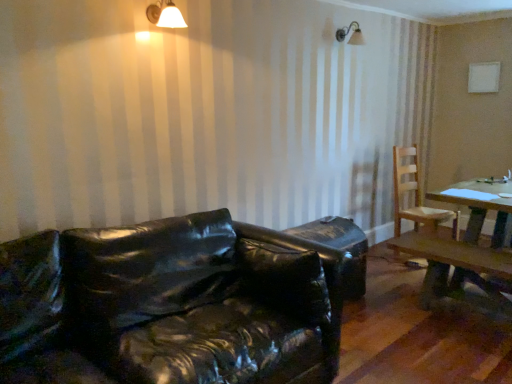
Measure the distance between glossy black leather couch at lower left and camera.

glossy black leather couch at lower left and camera are 5.23 feet apart.

Image resolution: width=512 pixels, height=384 pixels. Describe the element at coordinates (455, 266) in the screenshot. I see `wooden table at right` at that location.

What do you see at coordinates (165, 15) in the screenshot?
I see `white matte light fixture at upper center` at bounding box center [165, 15].

The height and width of the screenshot is (384, 512). What are the coordinates of `glossy black leather couch at lower left` in the screenshot? It's located at (178, 302).

Considering the sizes of objects glossy black leather couch at lower left and light brown wooden chair at right in the image provided, who is wider, glossy black leather couch at lower left or light brown wooden chair at right?

glossy black leather couch at lower left is wider.

In the scene shown: From a real-world perspective, is glossy black leather couch at lower left under light brown wooden chair at right?

Yes.

Is glossy black leather couch at lower left inside the boundaries of light brown wooden chair at right, or outside?

glossy black leather couch at lower left cannot be found inside light brown wooden chair at right.

Consider the image. Is light brown wooden chair at right outside of glossy black leather couch at lower left?

Yes, light brown wooden chair at right is located beyond the bounds of glossy black leather couch at lower left.

At what (x,y) coordinates should I click in order to perform the action: click on studio couch located underneath the light brown wooden chair at right (from a real-world perspective). Please return your answer as a coordinate pair (x, y). The image size is (512, 384). Looking at the image, I should click on (178, 302).

Is point (396, 207) farther from camera compared to point (13, 266)?

Yes, point (396, 207) is farther from viewer.

Looking at this image, from a real-world perspective, is light brown wooden chair at right above or below glossy black leather couch at lower left?

From a real-world perspective, light brown wooden chair at right is physically above glossy black leather couch at lower left.

Which is more to the right, wooden table at right or light brown wooden chair at right?

light brown wooden chair at right.

From the picture: Is wooden table at right further to camera compared to light brown wooden chair at right?

No, wooden table at right is closer to the camera.

Considering the sizes of objects wooden table at right and light brown wooden chair at right in the image provided, who is shorter, wooden table at right or light brown wooden chair at right?

wooden table at right is shorter.

Does wooden table at right turn towards light brown wooden chair at right?

Yes, wooden table at right is facing light brown wooden chair at right.

From the image's perspective, is light brown wooden chair at right over wooden table at right?

Correct, light brown wooden chair at right appears higher than wooden table at right in the image.

Does point (402, 193) come in front of point (464, 260)?

That is False.

What's the angular difference between light brown wooden chair at right and wooden table at right's facing directions?

95.7 degrees.

Which object is positioned more to the left, light brown wooden chair at right or wooden table at right?

wooden table at right.

From a real-world perspective, is glossy black leather couch at lower left located higher than white matte light fixture at upper center?

No, from a real-world perspective, glossy black leather couch at lower left is not above white matte light fixture at upper center.

Is glossy black leather couch at lower left located outside white matte light fixture at upper center?

Yes, glossy black leather couch at lower left is located beyond the bounds of white matte light fixture at upper center.

In the image, is glossy black leather couch at lower left positioned in front of or behind white matte light fixture at upper center?

Visually, glossy black leather couch at lower left is located in front of white matte light fixture at upper center.

Based on the photo, which object is closer to the camera, white matte light fixture at upper center or glossy black leather couch at lower left?

glossy black leather couch at lower left is more forward.

Would you say white matte light fixture at upper center is outside glossy black leather couch at lower left?

That's correct, white matte light fixture at upper center is outside of glossy black leather couch at lower left.

Is white matte light fixture at upper center with glossy black leather couch at lower left?

No, white matte light fixture at upper center is not next to glossy black leather couch at lower left.

From the image's perspective, relative to glossy black leather couch at lower left, is white matte light fixture at upper center above or below?

Clearly, from the image's perspective, white matte light fixture at upper center is above glossy black leather couch at lower left.

Does white matte light fixture at upper center turn towards wooden table at right?

No, white matte light fixture at upper center is not facing towards wooden table at right.

Based on the photo, can you confirm if white matte light fixture at upper center is shorter than wooden table at right?

Yes, white matte light fixture at upper center is shorter than wooden table at right.

Is white matte light fixture at upper center to the right of wooden table at right from the viewer's perspective?

No.

Locate an element on the screen. Image resolution: width=512 pixels, height=384 pixels. table on the right of white matte light fixture at upper center is located at coordinates (455, 266).

Find the location of `chair above the glossy black leather couch at lower left (from the image's perspective)`. chair above the glossy black leather couch at lower left (from the image's perspective) is located at coordinates (415, 195).

Where is `studio couch below the light brown wooden chair at right (from a real-world perspective)`? The width and height of the screenshot is (512, 384). studio couch below the light brown wooden chair at right (from a real-world perspective) is located at coordinates (178, 302).

Which object lies nearer to the anchor point glossy black leather couch at lower left, white matte light fixture at upper center or light brown wooden chair at right?

Among the two, white matte light fixture at upper center is located nearer to glossy black leather couch at lower left.

Considering their positions, is glossy black leather couch at lower left positioned closer to light brown wooden chair at right than white matte light fixture at upper center?

The object closer to light brown wooden chair at right is glossy black leather couch at lower left.

Based on their spatial positions, is white matte light fixture at upper center or glossy black leather couch at lower left further from light brown wooden chair at right?

Based on the image, white matte light fixture at upper center appears to be further to light brown wooden chair at right.

When comparing their distances from wooden table at right, does light brown wooden chair at right or white matte light fixture at upper center seem closer?

light brown wooden chair at right lies closer to wooden table at right than the other object.

Considering their positions, is light brown wooden chair at right positioned further to white matte light fixture at upper center than glossy black leather couch at lower left?

The object further to white matte light fixture at upper center is light brown wooden chair at right.

Based on their spatial positions, is glossy black leather couch at lower left or light brown wooden chair at right further from wooden table at right?

The object further to wooden table at right is glossy black leather couch at lower left.

Estimate the real-world distances between objects in this image. Which object is further from light brown wooden chair at right, wooden table at right or white matte light fixture at upper center?

Based on the image, white matte light fixture at upper center appears to be further to light brown wooden chair at right.

Estimate the real-world distances between objects in this image. Which object is closer to white matte light fixture at upper center, wooden table at right or glossy black leather couch at lower left?

glossy black leather couch at lower left is positioned closer to the anchor white matte light fixture at upper center.

This screenshot has width=512, height=384. I want to click on table between white matte light fixture at upper center and light brown wooden chair at right, so click(x=455, y=266).

What are the coordinates of `studio couch located between white matte light fixture at upper center and wooden table at right in the left-right direction` in the screenshot? It's located at (178, 302).

Where is `table positioned between glossy black leather couch at lower left and light brown wooden chair at right from near to far`? table positioned between glossy black leather couch at lower left and light brown wooden chair at right from near to far is located at coordinates (455, 266).

Locate an element on the screen. Image resolution: width=512 pixels, height=384 pixels. light fixture positioned between glossy black leather couch at lower left and light brown wooden chair at right from near to far is located at coordinates (165, 15).